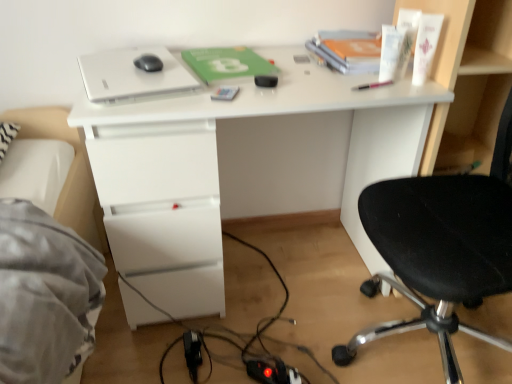
Locate an element on the screen. The width and height of the screenshot is (512, 384). vacant space behind black matte mouse at upper center is located at coordinates (146, 56).